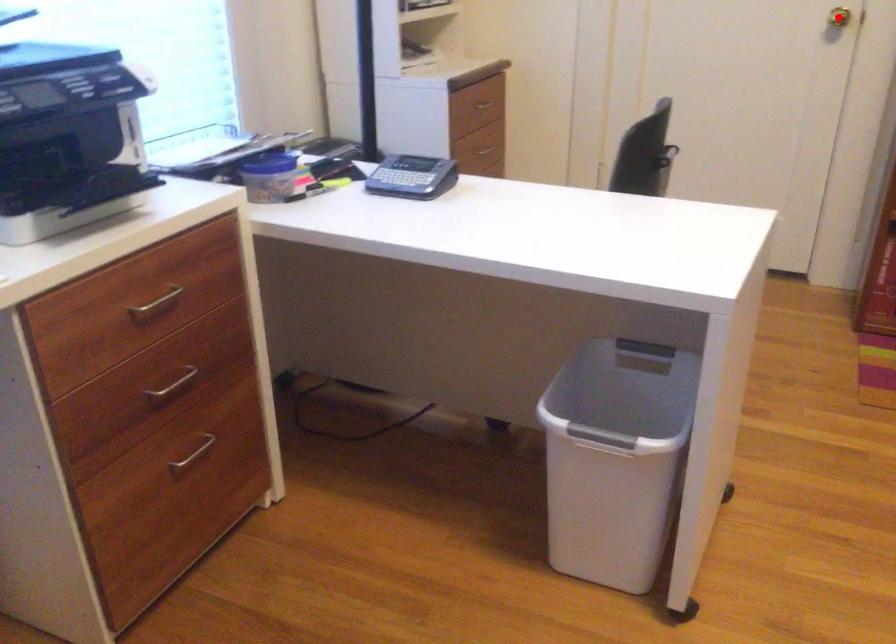
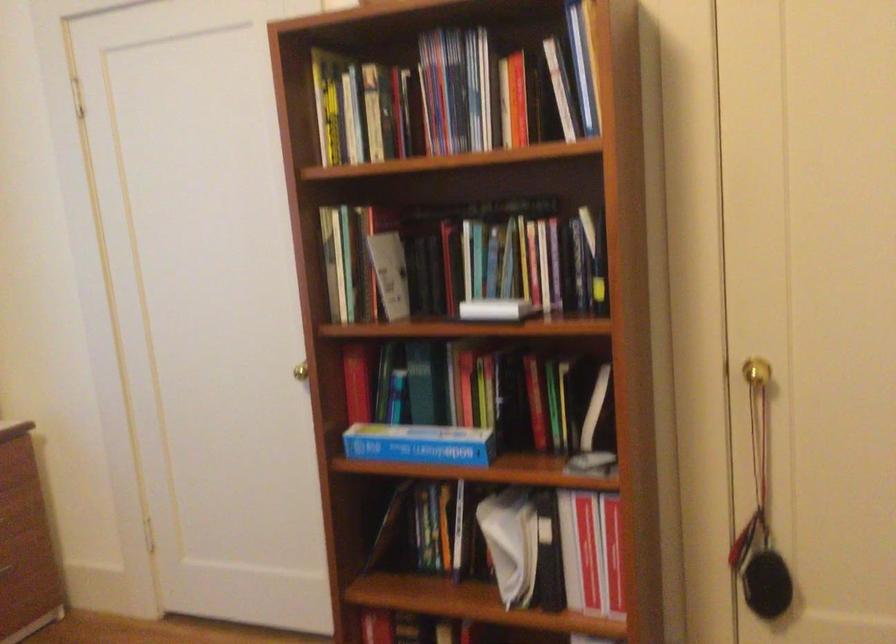
Question: I am providing you with two images of the same scene from different viewpoints. A red point is marked on the first image. Is the red point's position out of view in image 2?

Choices:
 (A) Yes
 (B) No

Answer: (A)